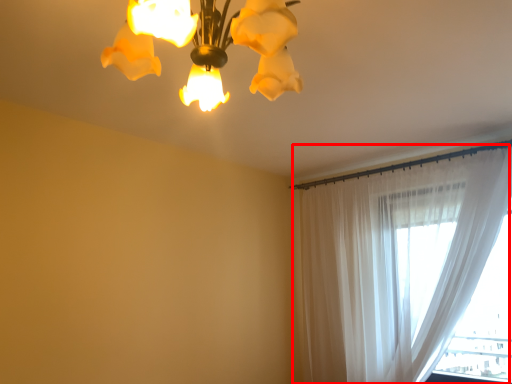
Question: Considering the relative positions of curtain (annotated by the red box) and lamp in the image provided, where is curtain (annotated by the red box) located with respect to the staircase?

Choices:
 (A) right
 (B) left

Answer: (A)